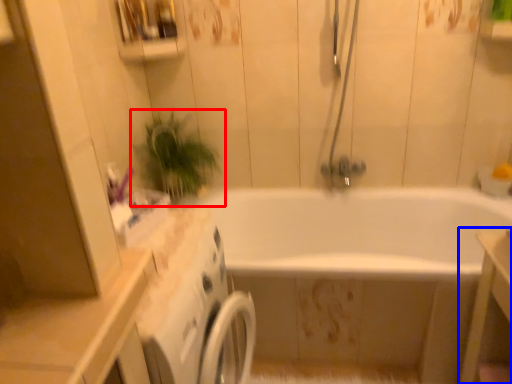
Question: Which point is closer to the camera, houseplant (highlighted by a red box) or vanity (highlighted by a blue box)?

Choices:
 (A) houseplant
 (B) vanity

Answer: (B)